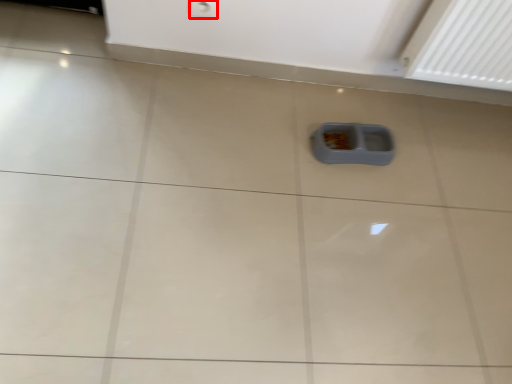
Question: From the image's perspective, considering the relative positions of electric outlet (annotated by the red box) and waste container in the image provided, where is electric outlet (annotated by the red box) located with respect to the staircase?

Choices:
 (A) below
 (B) above

Answer: (B)